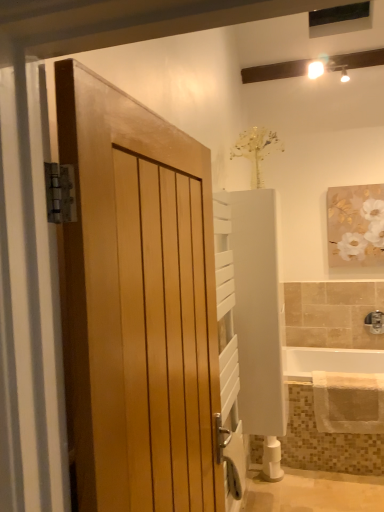
This screenshot has height=512, width=384. What do you see at coordinates (258, 310) in the screenshot?
I see `white matte radiator at center` at bounding box center [258, 310].

What do you see at coordinates (348, 402) in the screenshot? I see `beige textured bath towel at lower right` at bounding box center [348, 402].

In order to face beige textured bath towel at lower right, should I rotate leftwards or rightwards?

You should rotate right by 20.541 degrees.

I want to click on white matte painting at upper right, so click(x=365, y=232).

Between natural wood door at left and white matte toilet paper at lower center, which one has less height?

white matte toilet paper at lower center.

From the image's perspective, which one is positioned lower, natural wood door at left or white matte toilet paper at lower center?

From the image's view, white matte toilet paper at lower center is below.

Can you confirm if natural wood door at left is positioned to the right of white matte toilet paper at lower center?

No.

Does natural wood door at left have a larger size compared to white matte toilet paper at lower center?

Yes.

From a real-world perspective, which object rests below the other?

beige textured bath towel at lower right is physically lower.

Considering the sizes of objects white matte painting at upper right and beige textured bath towel at lower right in the image provided, who is thinner, white matte painting at upper right or beige textured bath towel at lower right?

Thinner between the two is white matte painting at upper right.

Is white matte painting at upper right touching beige textured bath towel at lower right?

No.

Which object is positioned more to the left, white matte painting at upper right or beige textured bath towel at lower right?

From the viewer's perspective, beige textured bath towel at lower right appears more on the left side.

Does beige textured bath towel at lower right come behind white matte painting at upper right?

No, the depth of beige textured bath towel at lower right is less than that of white matte painting at upper right.

From the image's perspective, does beige textured bath towel at lower right appear lower than white matte painting at upper right?

Yes.

Is beige textured bath towel at lower right outside of white matte painting at upper right?

beige textured bath towel at lower right lies outside white matte painting at upper right's area.

Is beige textured bath towel at lower right at the left side of white matte painting at upper right?

Yes, beige textured bath towel at lower right is to the left of white matte painting at upper right.

Is satin nickel faucet at lower right oriented away from beige textured bath towel at lower right?

No, satin nickel faucet at lower right is not facing the opposite direction of beige textured bath towel at lower right.

Consider the image. Between satin nickel faucet at lower right and beige textured bath towel at lower right, which one is positioned in front?

beige textured bath towel at lower right is more forward.

What's the angular difference between satin nickel faucet at lower right and beige textured bath towel at lower right's facing directions?

They differ by 2.14 degrees in their facing directions.

From the image's perspective, is satin nickel faucet at lower right located above beige textured bath towel at lower right?

Yes, from the image's perspective, satin nickel faucet at lower right is above beige textured bath towel at lower right.

Can you see white glossy bathtub at lower right touching white matte painting at upper right?

white glossy bathtub at lower right and white matte painting at upper right are clearly separated.

From a real-world perspective, which object rests below the other?

In real-world perspective, white glossy bathtub at lower right is lower.

Relative to white matte painting at upper right, is white glossy bathtub at lower right in front or behind?

In the image, white glossy bathtub at lower right appears in front of white matte painting at upper right.

Is white glossy bathtub at lower right not inside white matte painting at upper right?

Yes, white glossy bathtub at lower right is outside of white matte painting at upper right.

Is white matte radiator at center shorter than beige textured bath towel at lower right?

Incorrect, the height of white matte radiator at center does not fall short of that of beige textured bath towel at lower right.

Identify the location of bath towel behind the white matte radiator at center. (348, 402).

Is white matte radiator at center completely or partially outside of beige textured bath towel at lower right?

Yes, white matte radiator at center is outside of beige textured bath towel at lower right.

Which is in front, beige textured bath towel at lower right or white matte radiator at center?

white matte radiator at center.

How different are the orientations of beige textured bath towel at lower right and white matte radiator at center in degrees?

The angular difference between beige textured bath towel at lower right and white matte radiator at center is 90.6 degrees.

Looking at the image, does beige textured bath towel at lower right seem bigger or smaller compared to white matte radiator at center?

Considering their sizes, beige textured bath towel at lower right takes up less space than white matte radiator at center.

At what (x,y) coordinates should I click in order to perform the action: click on elevator above the beige textured bath towel at lower right (from a real-world perspective). Please return your answer as a coordinate pair (x, y). This screenshot has height=512, width=384. Looking at the image, I should click on (258, 310).

The height and width of the screenshot is (512, 384). In order to click on door lying on the left of white matte toilet paper at lower center in this screenshot , I will do `click(137, 304)`.

What are the coordinates of `bath towel beneath the white matte painting at upper right (from a real-world perspective)` in the screenshot? It's located at (348, 402).

Which object lies further to the anchor point white matte toilet paper at lower center, white matte radiator at center or white matte painting at upper right?

Among the two, white matte painting at upper right is located further to white matte toilet paper at lower center.

When comparing their distances from white glossy bathtub at lower right, does white matte painting at upper right or white matte toilet paper at lower center seem further?

Based on the image, white matte painting at upper right appears to be further to white glossy bathtub at lower right.

Estimate the real-world distances between objects in this image. Which object is closer to white glossy bathtub at lower right, satin nickel faucet at lower right or white matte painting at upper right?

satin nickel faucet at lower right.

Estimate the real-world distances between objects in this image. Which object is further from beige textured bath towel at lower right, satin nickel faucet at lower right or white matte painting at upper right?

white matte painting at upper right is further to beige textured bath towel at lower right.

Estimate the real-world distances between objects in this image. Which object is further from natural wood door at left, white matte painting at upper right or white matte toilet paper at lower center?

white matte painting at upper right is further to natural wood door at left.

When comparing their distances from white matte painting at upper right, does natural wood door at left or satin nickel faucet at lower right seem closer?

satin nickel faucet at lower right is closer to white matte painting at upper right.

Which object lies nearer to the anchor point white matte radiator at center, natural wood door at left or white glossy bathtub at lower right?

Based on the image, white glossy bathtub at lower right appears to be nearer to white matte radiator at center.

Looking at the image, which one is located further to white matte radiator at center, natural wood door at left or beige textured bath towel at lower right?

natural wood door at left lies further to white matte radiator at center than the other object.

At what (x,y) coordinates should I click in order to perform the action: click on tap between white matte painting at upper right and white glossy bathtub at lower right in the vertical direction. Please return your answer as a coordinate pair (x, y). The height and width of the screenshot is (512, 384). Looking at the image, I should click on (375, 322).

At what (x,y) coordinates should I click in order to perform the action: click on bath located between white matte radiator at center and satin nickel faucet at lower right in the depth direction. Please return your answer as a coordinate pair (x, y). The width and height of the screenshot is (384, 512). Looking at the image, I should click on (329, 361).

This screenshot has width=384, height=512. Identify the location of toilet paper between natural wood door at left and satin nickel faucet at lower right from front to back. (272, 460).

The width and height of the screenshot is (384, 512). In order to click on elevator between white matte painting at upper right and beige textured bath towel at lower right in the up-down direction in this screenshot , I will do `click(258, 310)`.